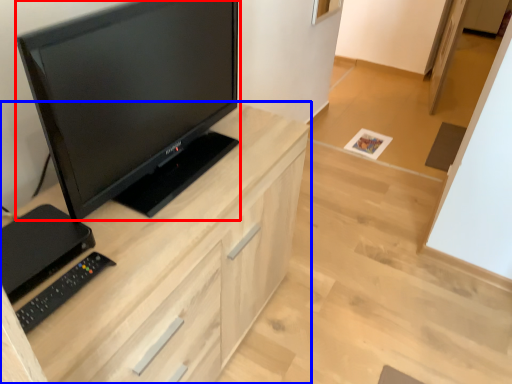
Question: Which point is further to the camera, television (highlighted by a red box) or cabinetry (highlighted by a blue box)?

Choices:
 (A) television
 (B) cabinetry

Answer: (B)